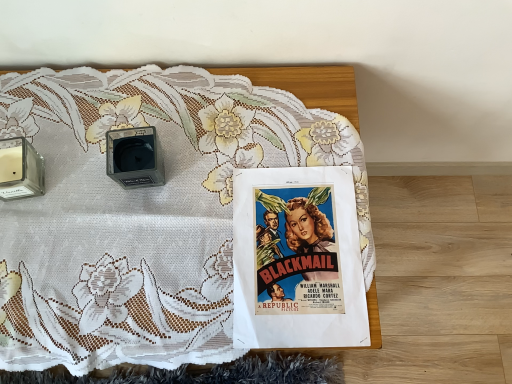
The width and height of the screenshot is (512, 384). I want to click on vacant area that lies between transparent glass candle at left, acting as the first speaker starting from the left, and matte paper poster at center, so click(147, 222).